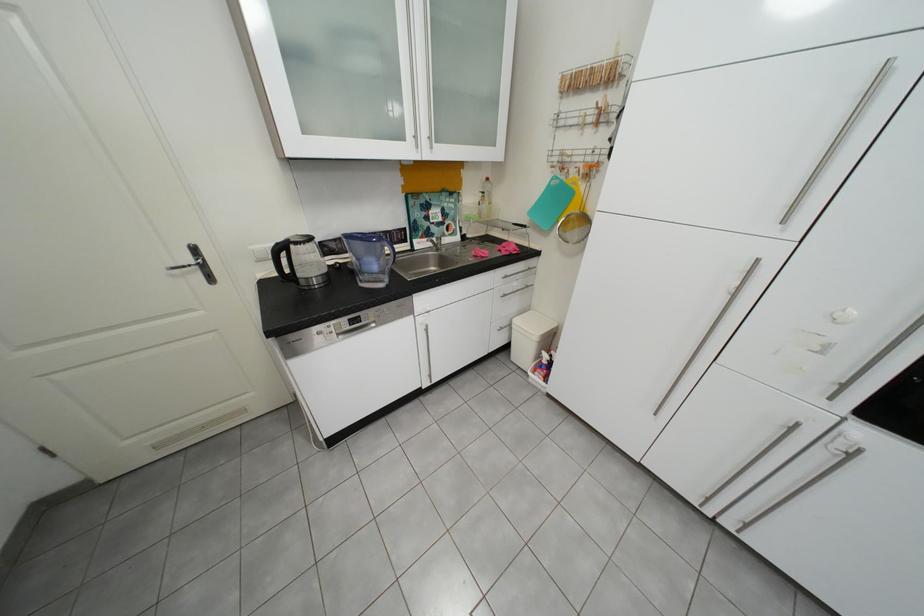
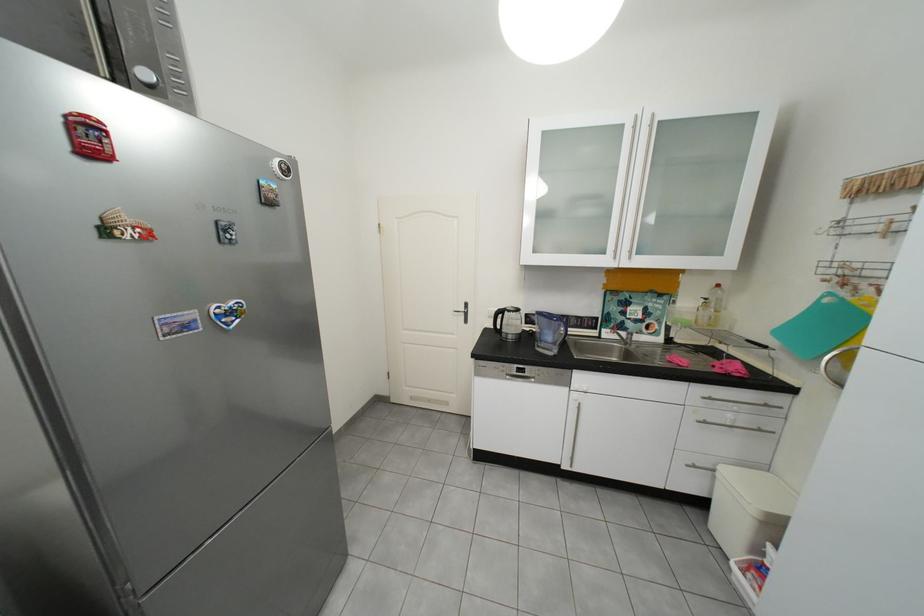
In the second image, find the point that corresponds to [581,87] in the first image.

(870, 192)